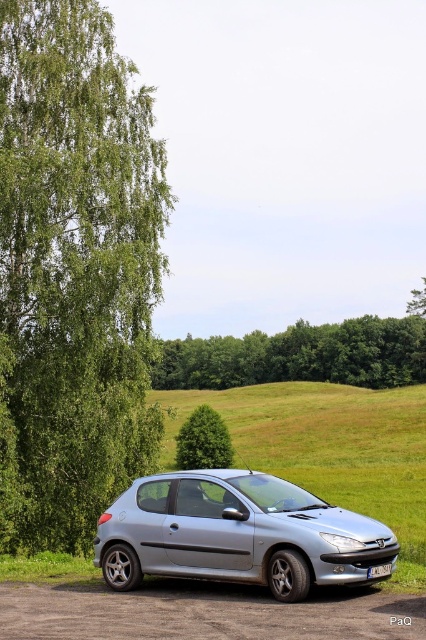
You are standing at the point closest to the car in the image. Which of the two points, point (x=66, y=285) or point (x=141, y=508), is farther away from you?

Point (x=66, y=285) is behind point (x=141, y=508), so it is farther away from you.

You are standing in front of the silver Peugeot 206 parked on the gravel surface. You want to take a photo of the car but need to ensure the green leafy tree at left is not in the frame. How far back should you move from the car to exclude the tree from the photo?

To exclude the green leafy tree at left from the photo, you should move at least 53.94 feet away from the car. This distance ensures the tree, which is 53.94 feet away from the camera, will be out of the frame when photographing the car.

You are standing at the point marked as point [299,355] in the image. What do you see around you?

At point [299,355], there are green leafy trees at center.